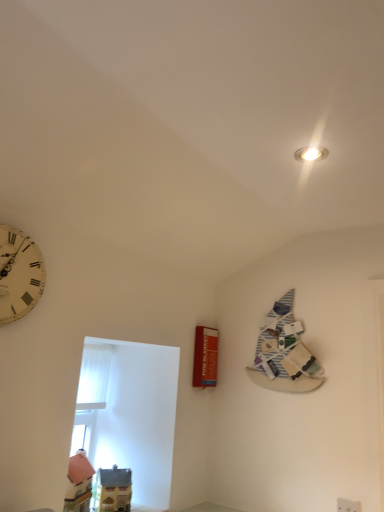
Question: Can you confirm if red matte fire blanket at center-right is positioned to the left of striped paper book at upper right?

Choices:
 (A) yes
 (B) no

Answer: (A)

Question: Does red matte fire blanket at center-right have a smaller size compared to striped paper book at upper right?

Choices:
 (A) yes
 (B) no

Answer: (A)

Question: Can you confirm if red matte fire blanket at center-right is taller than striped paper book at upper right?

Choices:
 (A) no
 (B) yes

Answer: (A)

Question: Considering the relative sizes of red matte fire blanket at center-right and striped paper book at upper right in the image provided, is red matte fire blanket at center-right shorter than striped paper book at upper right?

Choices:
 (A) no
 (B) yes

Answer: (B)

Question: Does red matte fire blanket at center-right come in front of striped paper book at upper right?

Choices:
 (A) no
 (B) yes

Answer: (A)

Question: Is point (213, 339) positioned closer to the camera than point (294, 332)?

Choices:
 (A) farther
 (B) closer

Answer: (A)

Question: Visually, is red matte fire blanket at center-right positioned to the left or to the right of striped paper book at upper right?

Choices:
 (A) right
 (B) left

Answer: (B)

Question: In terms of size, does red matte fire blanket at center-right appear bigger or smaller than striped paper book at upper right?

Choices:
 (A) big
 (B) small

Answer: (B)

Question: Is red matte fire blanket at center-right situated inside striped paper book at upper right or outside?

Choices:
 (A) inside
 (B) outside

Answer: (B)

Question: From the image's perspective, is white vintage clock at left located above or below white plastic electric outlet at lower right?

Choices:
 (A) above
 (B) below

Answer: (A)

Question: From a real-world perspective, is white vintage clock at left physically located above or below white plastic electric outlet at lower right?

Choices:
 (A) above
 (B) below

Answer: (A)

Question: Considering the relative positions of white vintage clock at left and white plastic electric outlet at lower right in the image provided, is white vintage clock at left to the left or to the right of white plastic electric outlet at lower right?

Choices:
 (A) right
 (B) left

Answer: (B)

Question: Is white vintage clock at left wider or thinner than white plastic electric outlet at lower right?

Choices:
 (A) wide
 (B) thin

Answer: (A)

Question: Is red matte fire blanket at center-right taller or shorter than white vintage clock at left?

Choices:
 (A) short
 (B) tall

Answer: (B)

Question: Visually, is red matte fire blanket at center-right positioned to the left or to the right of white vintage clock at left?

Choices:
 (A) right
 (B) left

Answer: (A)